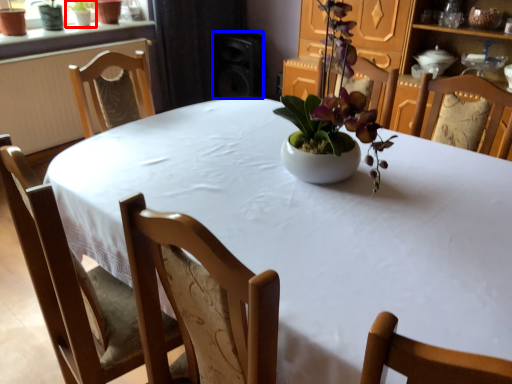
Question: Which point is closer to the camera, houseplant (highlighted by a red box) or speaker (highlighted by a blue box)?

Choices:
 (A) houseplant
 (B) speaker

Answer: (A)